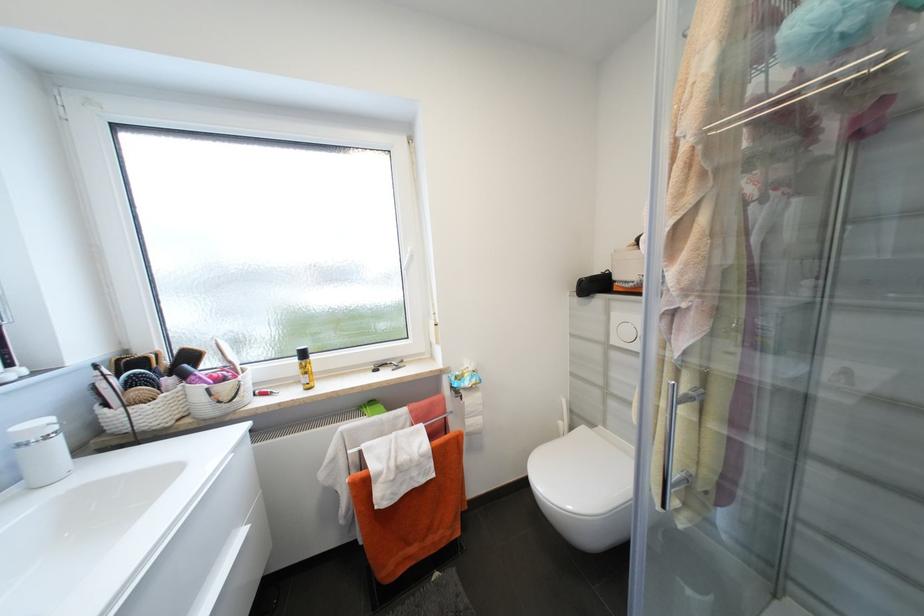
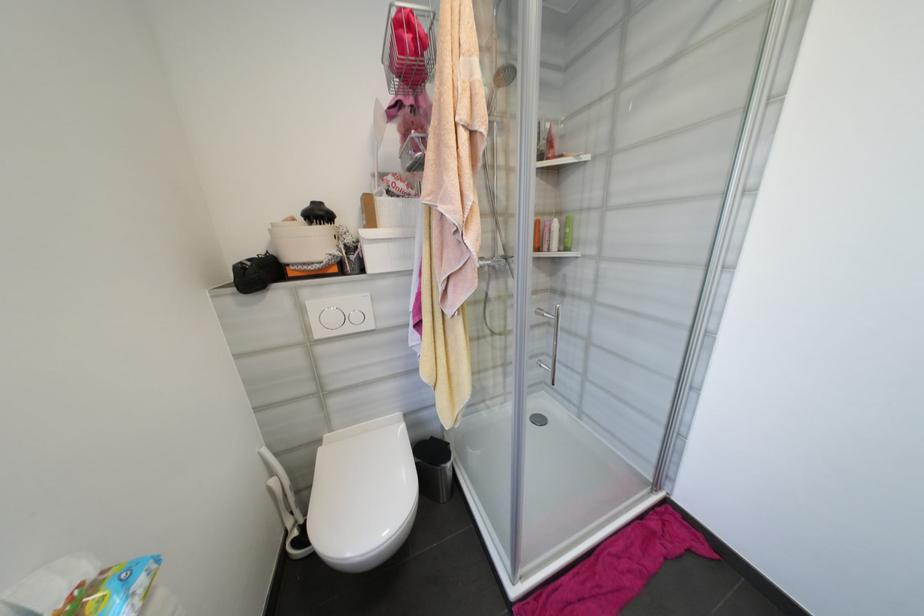
Question: The images are taken continuously from a first-person perspective. In which direction is your viewpoint rotating?

Choices:
 (A) Left
 (B) Right
 (C) Up
 (D) Down

Answer: (B)